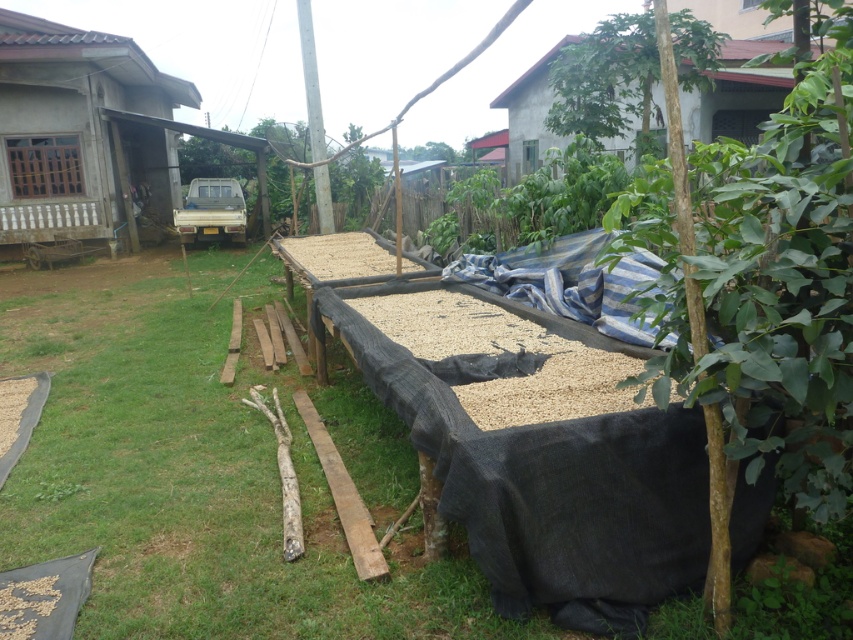
You are standing at the center of the image and want to go to the light brown wooden hut at left. Which direction should you head towards?

You should head towards the left direction to reach the light brown wooden hut at left as it is located at point 0.209 on the x axis which is to the left of the center point 0.5.